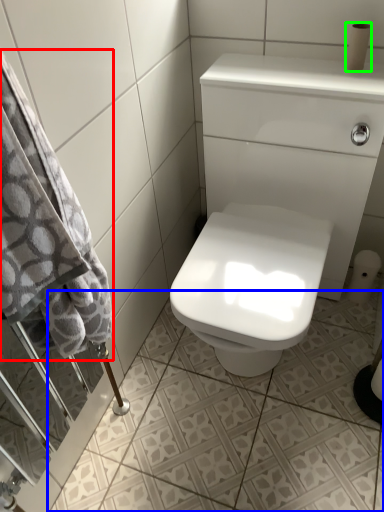
Question: Considering the real-world distances, which object is farthest from bath towel (highlighted by a red box)? ceramic tile (highlighted by a blue box) or toilet paper (highlighted by a green box)?

Choices:
 (A) ceramic tile
 (B) toilet paper

Answer: (B)